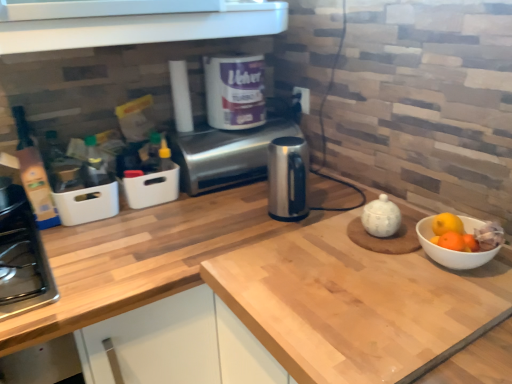
Find the location of `vacant space to the left of white glossy tea pot at center-right`. vacant space to the left of white glossy tea pot at center-right is located at coordinates (314, 249).